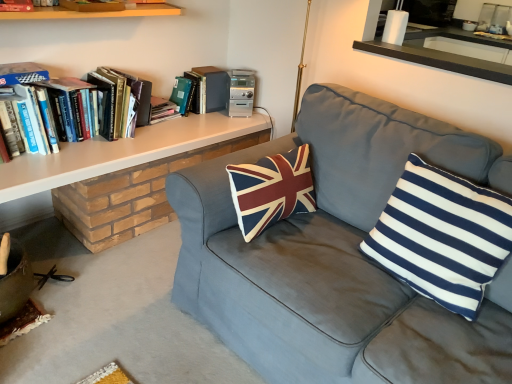
Where is `spots to the right of hardcover book at upper left, the third book viewed from the front`? Image resolution: width=512 pixels, height=384 pixels. spots to the right of hardcover book at upper left, the third book viewed from the front is located at coordinates (185, 124).